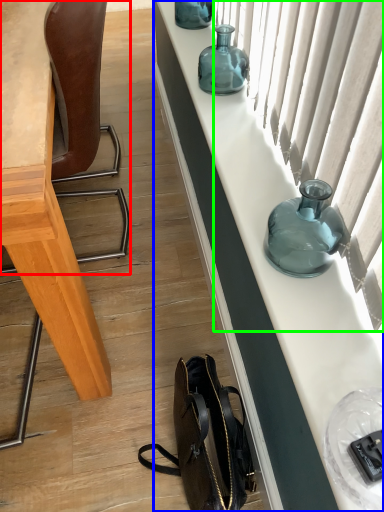
Question: Which is nearer to the chair (highlighted by a red box)? cabinetry (highlighted by a blue box) or curtain (highlighted by a green box).

Choices:
 (A) cabinetry
 (B) curtain

Answer: (A)